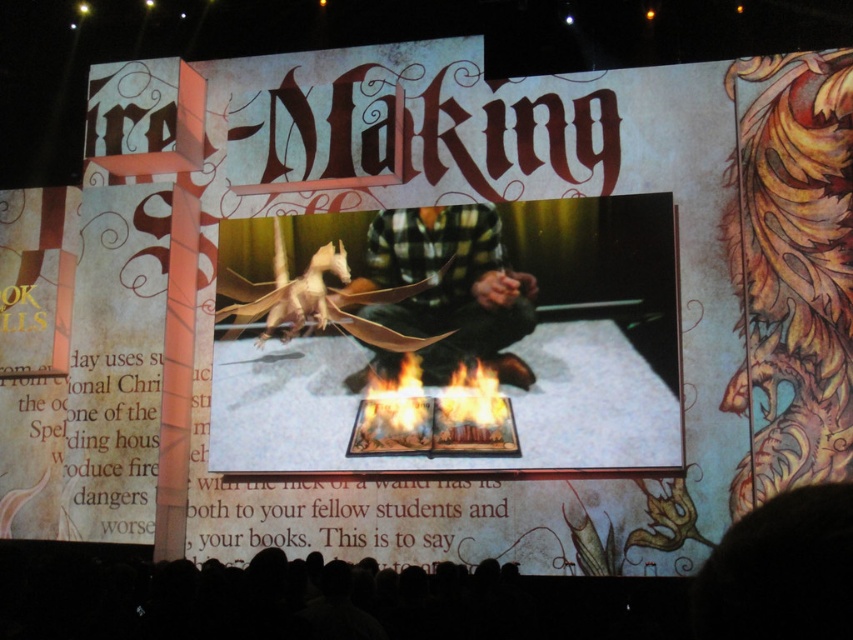
You are a stagehand preparing for a performance. You need to ensure that the green plaid shirt at center and the flametransparentbook at center are positioned so that there is a minimum of 20 feet between them for safety. Based on the current setup, is this requirement met?

The distance between the green plaid shirt at center and the flametransparentbook at center is 25.46 feet, which exceeds the required 20 feet, so the safety requirement is met.

You are an audience member sitting in the front row of the stage. You notice two items at the center of the screen, the paper dragon at center and the green plaid shirt at center. Which one appears closer to you?

The paper dragon at center is closer to the viewer than the green plaid shirt at center.

You are an event planner setting up a fantasy stage. The paper dragon at center needs to be positioned precisely for a lighting effect. Given its coordinates at point 0.531, 0.516, can you confirm if it is placed exactly in the center of the stage?

The paper dragon at center is located at point (439, 339). Since the coordinates are close to 0.5 in both x and y axes, it is approximately centered on the stage.